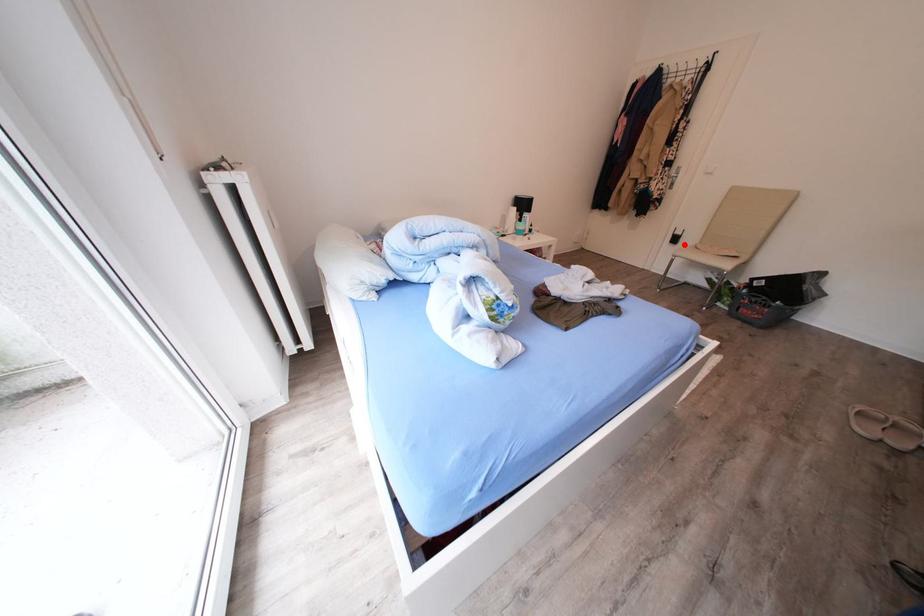
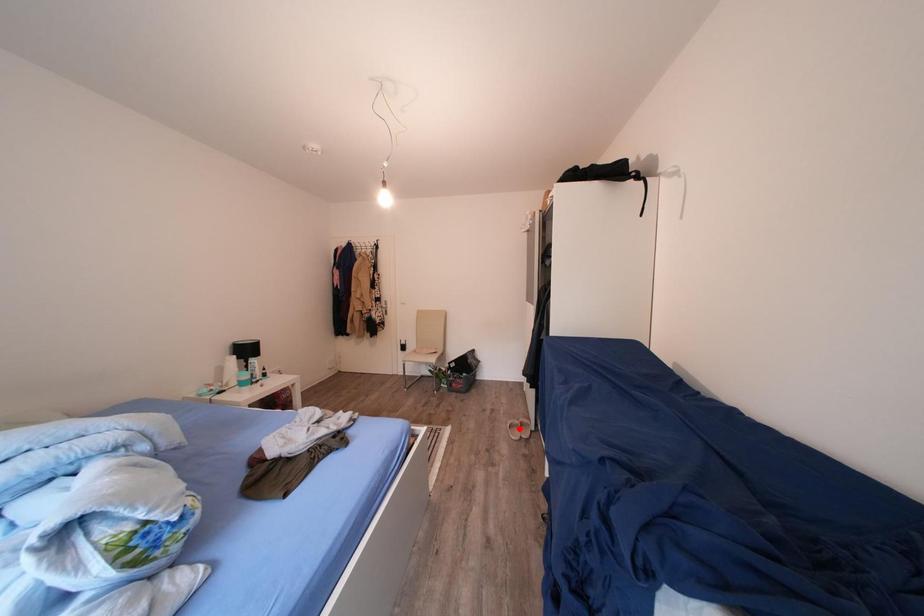
I am providing you with two images of the same scene from different viewpoints. A red point is marked on the first image and another point is marked on the second image. Is the marked point in image1 the same physical position as the marked point in image2?

No